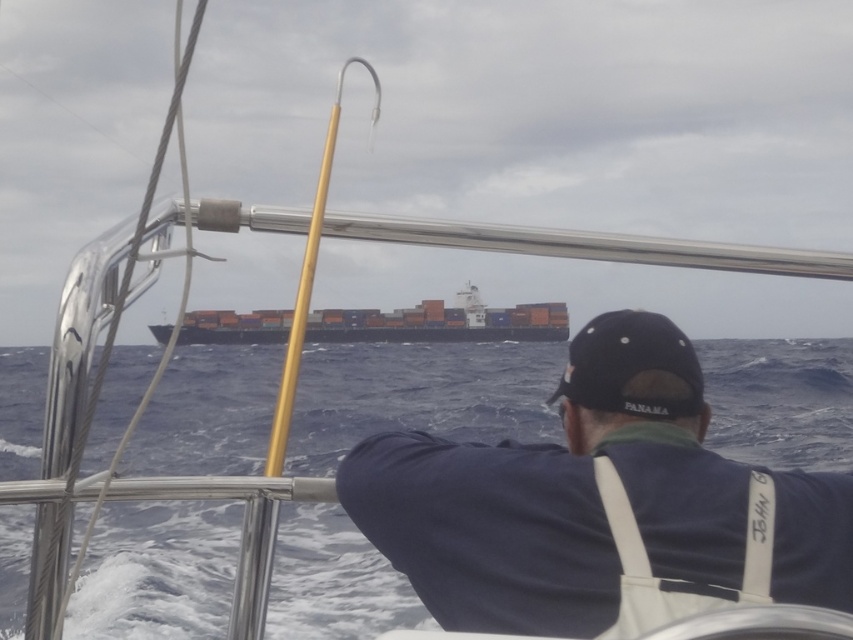
You are on a boat and want to know if the blue water at center is deeper than the orange matte container ship at center. Can you determine this based on the scene?

The blue water at center is shorter than the orange matte container ship at center, which suggests that the water is not deeper than the ship. However, depth cannot be accurately determined from this perspective alone.